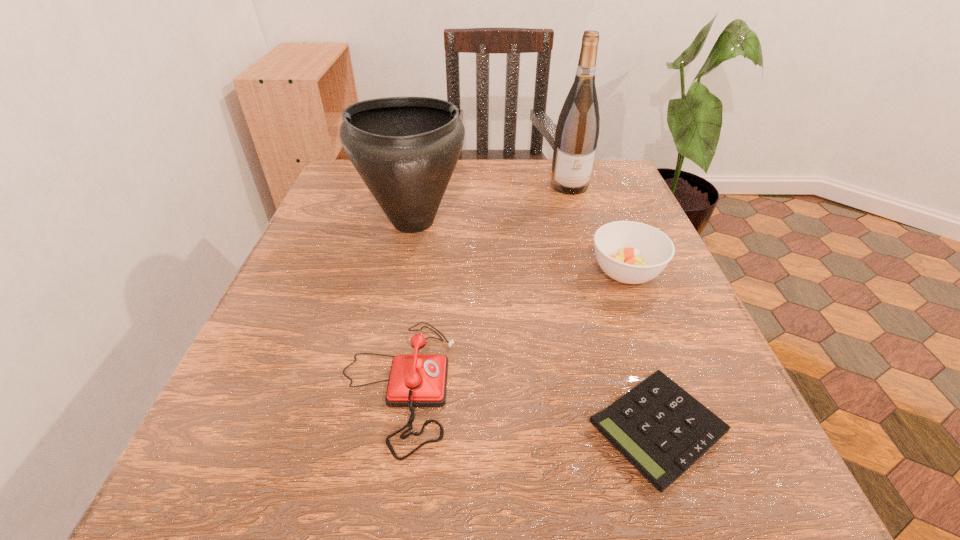
This screenshot has height=540, width=960. What are the coordinates of `wine bottle` in the screenshot? It's located at (577, 131).

You are a GUI agent. You are given a task and a screenshot of the screen. Output one action in this format:
    pyautogui.click(x=<x>, y=<y>)
    Task: Click on the fourth shortest object
    
    Given the screenshot: What is the action you would take?
    coord(405,149)

Locate an element on the screen. The width and height of the screenshot is (960, 540). soup bowl is located at coordinates (630, 252).

Where is `telephone`? telephone is located at coordinates (415, 380).

Where is `calculator`? The image size is (960, 540). calculator is located at coordinates (662, 430).

Locate an element on the screen. This screenshot has width=960, height=540. vacant region located 0.160m on the label of the tallest object is located at coordinates (585, 235).

Identify the location of free region located 0.310m on the right of the fourth shortest object. click(612, 221).

Locate an element on the screen. The image size is (960, 540). vacant space located on the back of the soup bowl is located at coordinates (590, 180).

The width and height of the screenshot is (960, 540). I want to click on blank area located on the dial of the telephone, so click(712, 385).

Identify the location of blank space located on the back of the shortest object. The image size is (960, 540). (618, 310).